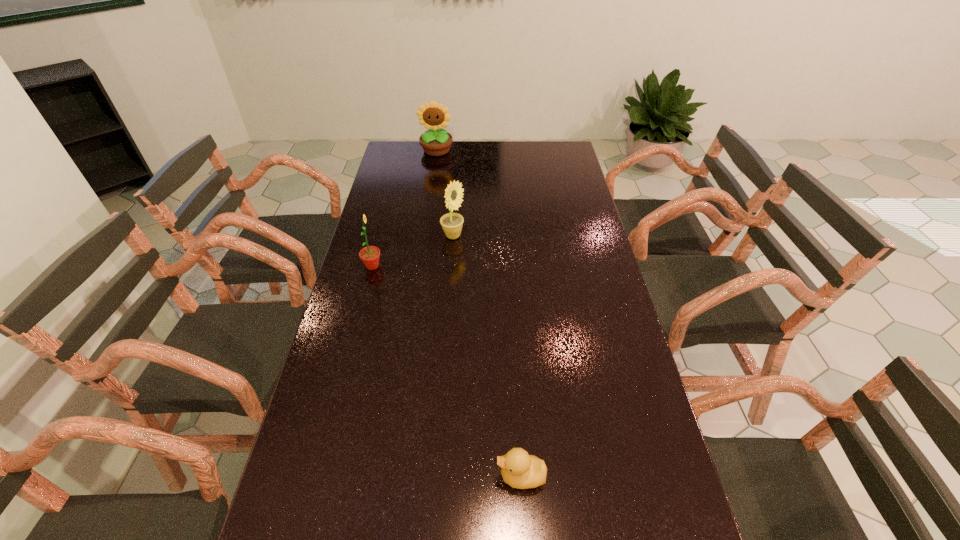
The height and width of the screenshot is (540, 960). What are the coordinates of `the farthest object` in the screenshot? It's located at (436, 142).

You are a GUI agent. You are given a task and a screenshot of the screen. Output one action in this format:
    pyautogui.click(x=<x>, y=<y>)
    Task: Click on the third nearest object
    The width and height of the screenshot is (960, 540).
    Given the screenshot: What is the action you would take?
    pyautogui.click(x=452, y=223)

Where is `the nearest sunflower`? This screenshot has width=960, height=540. the nearest sunflower is located at coordinates (370, 255).

Where is `the second nearest object`? the second nearest object is located at coordinates (370, 255).

This screenshot has height=540, width=960. Find the location of `the nearest object`. the nearest object is located at coordinates (519, 470).

What are the coordinates of `the shortest object` in the screenshot? It's located at (519, 470).

Find the location of a particular element. Image resolution: width=960 pixels, height=540 pixels. free region located 0.190m on the face of the farthest object is located at coordinates (432, 181).

Locate an element on the screen. This screenshot has height=540, width=960. free space located on the face of the second nearest sunflower is located at coordinates (488, 237).

Find the location of a particular element. vacant space situated on the face of the leftmost object is located at coordinates (419, 266).

In order to click on free region located on the face of the rightmost object in this screenshot , I will do `click(442, 476)`.